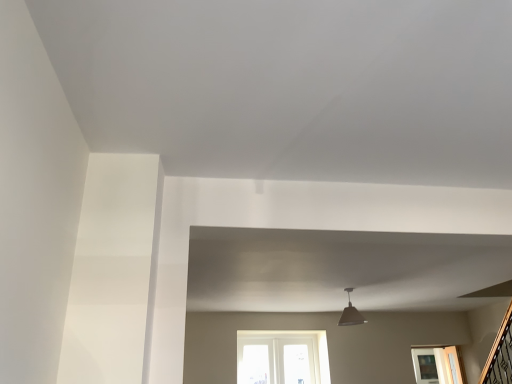
Question: From the image's perspective, relative to matte gray lampshade at upper center, is clear glass cabinet at lower right above or below?

Choices:
 (A) above
 (B) below

Answer: (B)

Question: Is clear glass cabinet at lower right inside or outside of matte gray lampshade at upper center?

Choices:
 (A) outside
 (B) inside

Answer: (A)

Question: From a real-world perspective, is clear glass cabinet at lower right positioned above or below matte gray lampshade at upper center?

Choices:
 (A) below
 (B) above

Answer: (A)

Question: Is matte gray lampshade at upper center wider or thinner than clear glass cabinet at lower right?

Choices:
 (A) wide
 (B) thin

Answer: (B)

Question: In terms of size, does matte gray lampshade at upper center appear bigger or smaller than clear glass cabinet at lower right?

Choices:
 (A) big
 (B) small

Answer: (B)

Question: Considering their positions, is matte gray lampshade at upper center located in front of or behind clear glass cabinet at lower right?

Choices:
 (A) front
 (B) behind

Answer: (A)

Question: Based on their positions, is matte gray lampshade at upper center located to the left or right of clear glass cabinet at lower right?

Choices:
 (A) right
 (B) left

Answer: (B)